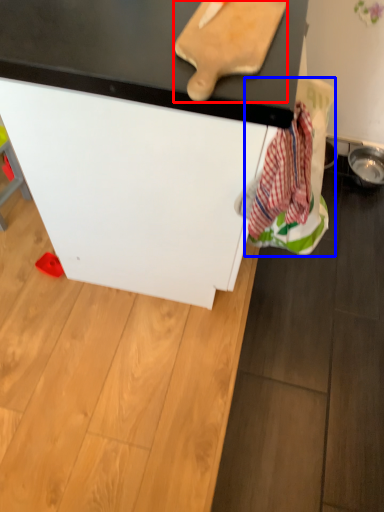
Question: Among these objects, which one is farthest to the camera, cutting board (highlighted by a red box) or laundry (highlighted by a blue box)?

Choices:
 (A) cutting board
 (B) laundry

Answer: (B)